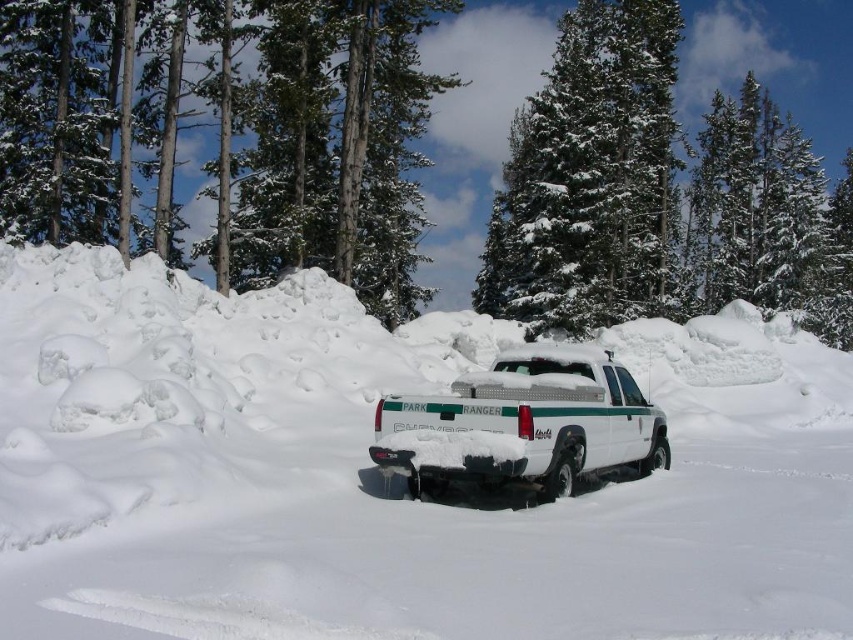
Question: Among these objects, which one is nearest to the camera?

Choices:
 (A) snow-covered evergreen at center
 (B) white matte truck at center
 (C) white fluffy snow at center
 (D) green textured pine trees at upper center

Answer: (C)

Question: Is white fluffy snow at center bigger than snow-covered evergreen at center?

Choices:
 (A) no
 (B) yes

Answer: (A)

Question: Which of these objects is positioned closest to the snow-covered evergreen at center?

Choices:
 (A) green textured pine trees at upper center
 (B) white fluffy snow at center
 (C) white matte truck at center

Answer: (A)

Question: Where is snow-covered evergreen at center located in relation to white matte truck at center in the image?

Choices:
 (A) above
 (B) below

Answer: (A)

Question: Which is nearer to the white fluffy snow at center?

Choices:
 (A) white matte truck at center
 (B) snow-covered evergreen at center
 (C) green textured pine trees at upper center

Answer: (A)

Question: Is green textured pine trees at upper center bigger than snow-covered evergreen at center?

Choices:
 (A) yes
 (B) no

Answer: (A)